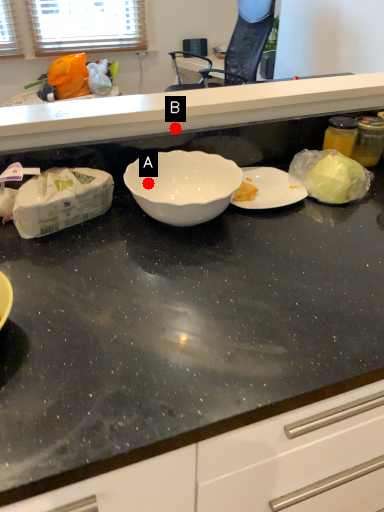
Question: Two points are circled on the image, labeled by A and B beside each circle. Which point appears farthest from the camera in this image?

Choices:
 (A) A is further
 (B) B is further

Answer: (B)